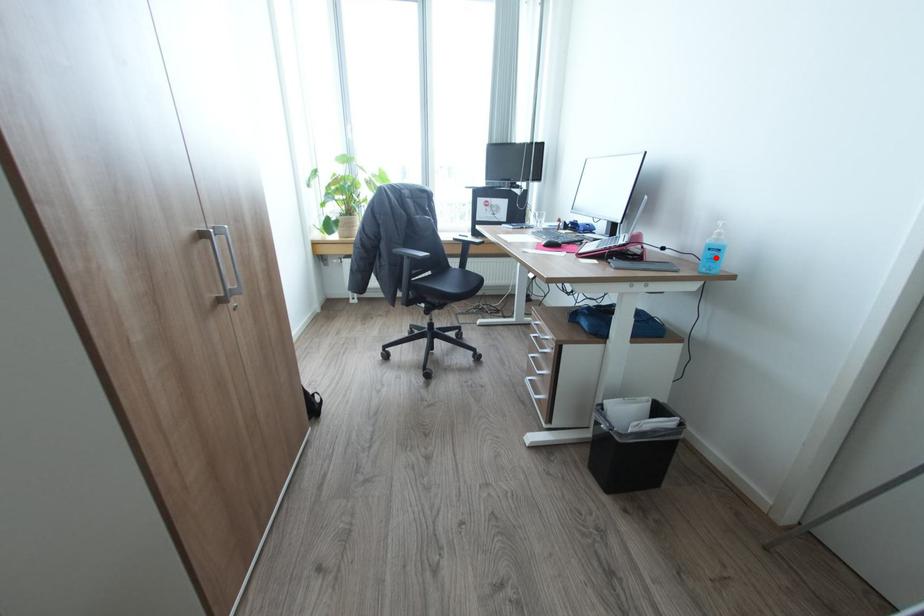
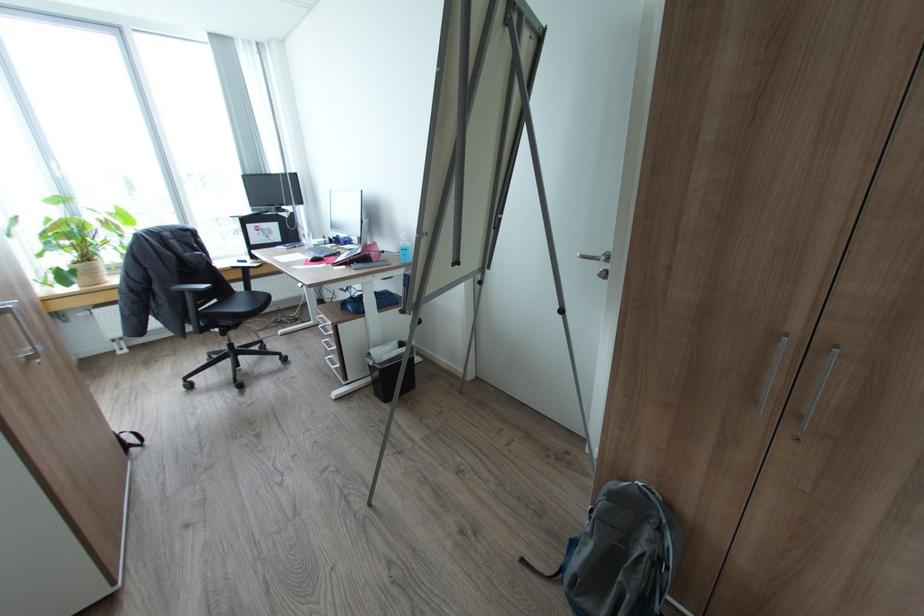
Locate, in the second image, the point that corresponds to the highlighted location in the first image.

(408, 254)